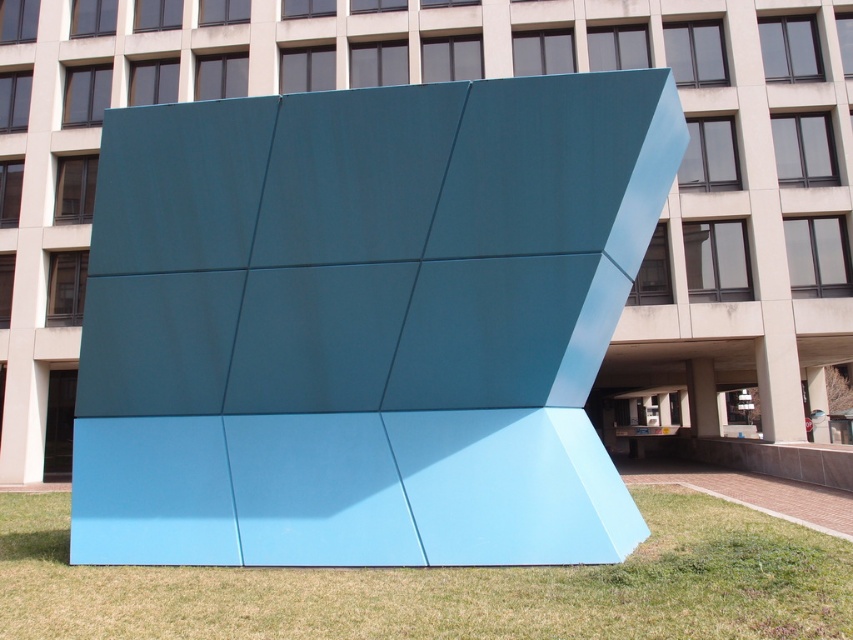
Question: Which point is closer to the camera taking this photo?

Choices:
 (A) (805, 612)
 (B) (584, 531)

Answer: (A)

Question: Can you confirm if teal matte sculpture at center is smaller than green grass at lower center?

Choices:
 (A) yes
 (B) no

Answer: (B)

Question: Among these objects, which one is nearest to the camera?

Choices:
 (A) teal matte sculpture at center
 (B) green grass at lower center

Answer: (B)

Question: Is teal matte sculpture at center to the right of green grass at lower center from the viewer's perspective?

Choices:
 (A) yes
 (B) no

Answer: (B)

Question: Is teal matte sculpture at center bigger than green grass at lower center?

Choices:
 (A) yes
 (B) no

Answer: (A)